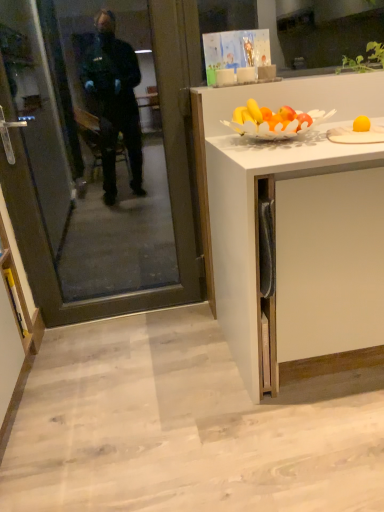
At what (x,y) coordinates should I click in order to perform the action: click on transparent glass door at left. Please return your answer as a coordinate pair (x, y). Looking at the image, I should click on (168, 184).

Describe the element at coordinates (357, 133) in the screenshot. This screenshot has width=384, height=512. I see `yellow matte plate at upper right` at that location.

Find the location of a particular element. The width and height of the screenshot is (384, 512). yellow marker at lower left, placed as the first cabinetry when sorted from left to right is located at coordinates (21, 306).

Where is `transparent glass door at left`? Image resolution: width=384 pixels, height=512 pixels. transparent glass door at left is located at coordinates (168, 184).

From a real-world perspective, which is physically above, yellow marker at lower left, the second cabinetry when ordered from right to left, or transparent glass door at left?

transparent glass door at left.

Does yellow marker at lower left, placed as the first cabinetry when sorted from left to right, touch transparent glass door at left?

There is a gap between yellow marker at lower left, placed as the first cabinetry when sorted from left to right, and transparent glass door at left.

Is the position of yellow marker at lower left, placed as the first cabinetry when sorted from left to right, less distant than that of transparent glass door at left?

No, yellow marker at lower left, placed as the first cabinetry when sorted from left to right, is further to the viewer.

Considering the points (106, 301) and (15, 311), which point is behind, point (106, 301) or point (15, 311)?

The point (106, 301) is farther from the camera.

From the picture: What's the angular difference between transparent glass door at left and yellow marker at lower left, placed as the first cabinetry when sorted from left to right,'s facing directions?

90.2 degrees separate the facing orientations of transparent glass door at left and yellow marker at lower left, placed as the first cabinetry when sorted from left to right.

Choose the correct answer: Is transparent glass door at left inside yellow marker at lower left, the second cabinetry when ordered from right to left, or outside it?

transparent glass door at left cannot be found inside yellow marker at lower left, the second cabinetry when ordered from right to left.

Is transparent glass door at left bigger or smaller than yellow marker at lower left, placed as the first cabinetry when sorted from left to right?

Considering their sizes, transparent glass door at left takes up more space than yellow marker at lower left, placed as the first cabinetry when sorted from left to right.

Does yellow marker at lower left, the second cabinetry when ordered from right to left, lie behind white matte cabinet at right, acting as the 2th cabinetry starting from the left?

Yes, the depth of yellow marker at lower left, the second cabinetry when ordered from right to left, is greater than that of white matte cabinet at right, acting as the 2th cabinetry starting from the left.

Is yellow marker at lower left, placed as the first cabinetry when sorted from left to right, situated inside white matte cabinet at right, acting as the 2th cabinetry starting from the left, or outside?

yellow marker at lower left, placed as the first cabinetry when sorted from left to right, is not enclosed by white matte cabinet at right, acting as the 2th cabinetry starting from the left.

In the image, is yellow marker at lower left, the second cabinetry when ordered from right to left, on the left side or the right side of white matte cabinet at right, acting as the 2th cabinetry starting from the left?

From the image, it's evident that yellow marker at lower left, the second cabinetry when ordered from right to left, is to the left of white matte cabinet at right, acting as the 2th cabinetry starting from the left.

How distant is yellow marker at lower left, placed as the first cabinetry when sorted from left to right, from white matte cabinet at right, arranged as the first cabinetry when viewed from the right?

yellow marker at lower left, placed as the first cabinetry when sorted from left to right, is 1.11 meters from white matte cabinet at right, arranged as the first cabinetry when viewed from the right.

In the scene shown: Considering the relative sizes of yellow matte plate at upper right and yellow marker at lower left, placed as the first cabinetry when sorted from left to right, in the image provided, is yellow matte plate at upper right smaller than yellow marker at lower left, placed as the first cabinetry when sorted from left to right,?

Actually, yellow matte plate at upper right might be larger than yellow marker at lower left, placed as the first cabinetry when sorted from left to right.

From the image's perspective, which object appears higher, yellow matte plate at upper right or yellow marker at lower left, the second cabinetry when ordered from right to left?

yellow matte plate at upper right appears higher in the image.

Is yellow matte plate at upper right spatially inside yellow marker at lower left, placed as the first cabinetry when sorted from left to right, or outside of it?

yellow matte plate at upper right is not inside yellow marker at lower left, placed as the first cabinetry when sorted from left to right, it's outside.

Locate an element on the screen. The width and height of the screenshot is (384, 512). plate that is above the white matte cabinet at right, arranged as the first cabinetry when viewed from the right (from a real-world perspective) is located at coordinates (357, 133).

Which of these two, white matte cabinet at right, arranged as the first cabinetry when viewed from the right, or yellow matte plate at upper right, stands shorter?

Standing shorter between the two is yellow matte plate at upper right.

Looking at this image, between white matte cabinet at right, acting as the 2th cabinetry starting from the left, and yellow matte plate at upper right, which one has smaller size?

Smaller between the two is yellow matte plate at upper right.

Is point (35, 283) farther from camera compared to point (369, 131)?

Yes, point (35, 283) is behind point (369, 131).

Which object is further away from the camera, transparent glass door at left or yellow matte plate at upper right?

Positioned behind is transparent glass door at left.

Locate an element on the screen. plate on the right of transparent glass door at left is located at coordinates (357, 133).

Who is shorter, yellow matte plate at upper right or white matte cabinet at right, acting as the 2th cabinetry starting from the left?

Standing shorter between the two is yellow matte plate at upper right.

Between yellow matte plate at upper right and white matte cabinet at right, arranged as the first cabinetry when viewed from the right, which one has larger width?

white matte cabinet at right, arranged as the first cabinetry when viewed from the right, is wider.

Is yellow matte plate at upper right facing towards white matte cabinet at right, arranged as the first cabinetry when viewed from the right?

No.

Based on the photo, from a real-world perspective, which is physically above, yellow matte plate at upper right or white matte cabinet at right, acting as the 2th cabinetry starting from the left?

yellow matte plate at upper right.

Image resolution: width=384 pixels, height=512 pixels. In order to click on screen door on the right of the yellow marker at lower left, the second cabinetry when ordered from right to left in this screenshot , I will do `click(168, 184)`.

Image resolution: width=384 pixels, height=512 pixels. I want to click on screen door positioned vertically above the yellow marker at lower left, placed as the first cabinetry when sorted from left to right (from a real-world perspective), so click(168, 184).

Estimate the real-world distances between objects in this image. Which object is closer to yellow matte plate at upper right, transparent glass door at left or yellow marker at lower left, placed as the first cabinetry when sorted from left to right?

transparent glass door at left.

Looking at the image, which one is located further to yellow marker at lower left, placed as the first cabinetry when sorted from left to right, yellow matte plate at upper right or white matte cabinet at right, arranged as the first cabinetry when viewed from the right?

Among the two, yellow matte plate at upper right is located further to yellow marker at lower left, placed as the first cabinetry when sorted from left to right.

Which object lies further to the anchor point yellow matte plate at upper right, yellow marker at lower left, the second cabinetry when ordered from right to left, or white matte cabinet at right, arranged as the first cabinetry when viewed from the right?

Based on the image, yellow marker at lower left, the second cabinetry when ordered from right to left, appears to be further to yellow matte plate at upper right.

Consider the image. Which object lies further to the anchor point white matte cabinet at right, arranged as the first cabinetry when viewed from the right, transparent glass door at left or yellow matte plate at upper right?

transparent glass door at left.

Estimate the real-world distances between objects in this image. Which object is closer to transparent glass door at left, yellow marker at lower left, placed as the first cabinetry when sorted from left to right, or white matte cabinet at right, arranged as the first cabinetry when viewed from the right?

yellow marker at lower left, placed as the first cabinetry when sorted from left to right.

Looking at the image, which one is located further to yellow marker at lower left, placed as the first cabinetry when sorted from left to right, transparent glass door at left or yellow matte plate at upper right?

Among the two, yellow matte plate at upper right is located further to yellow marker at lower left, placed as the first cabinetry when sorted from left to right.

Estimate the real-world distances between objects in this image. Which object is further from yellow marker at lower left, the second cabinetry when ordered from right to left, white matte cabinet at right, acting as the 2th cabinetry starting from the left, or yellow matte plate at upper right?

yellow matte plate at upper right is positioned further to the anchor yellow marker at lower left, the second cabinetry when ordered from right to left.

Looking at the image, which one is located further to transparent glass door at left, white matte cabinet at right, acting as the 2th cabinetry starting from the left, or yellow matte plate at upper right?

yellow matte plate at upper right is positioned further to the anchor transparent glass door at left.

I want to click on cabinetry situated between transparent glass door at left and yellow matte plate at upper right from left to right, so click(x=294, y=224).

Where is `cabinetry situated between yellow marker at lower left, placed as the first cabinetry when sorted from left to right, and yellow matte plate at upper right from left to right`? The image size is (384, 512). cabinetry situated between yellow marker at lower left, placed as the first cabinetry when sorted from left to right, and yellow matte plate at upper right from left to right is located at coordinates (294, 224).

Identify the location of screen door located between yellow marker at lower left, placed as the first cabinetry when sorted from left to right, and yellow matte plate at upper right in the left-right direction. (168, 184).

Where is `screen door situated between yellow marker at lower left, placed as the first cabinetry when sorted from left to right, and white matte cabinet at right, acting as the 2th cabinetry starting from the left, from left to right`? This screenshot has width=384, height=512. screen door situated between yellow marker at lower left, placed as the first cabinetry when sorted from left to right, and white matte cabinet at right, acting as the 2th cabinetry starting from the left, from left to right is located at coordinates (168, 184).